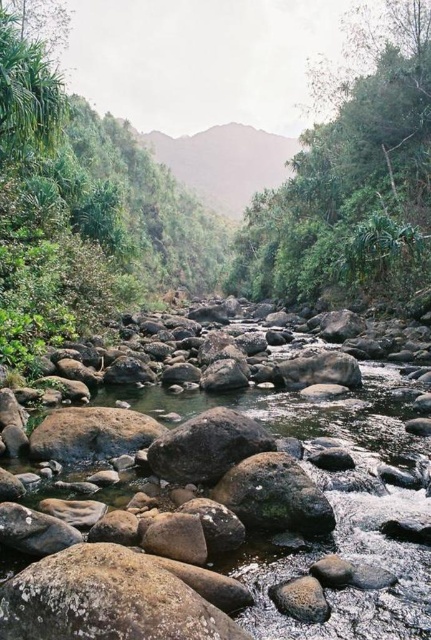
Question: Can you confirm if green leafy tree at upper right is bigger than green leafy tree at upper left?

Choices:
 (A) yes
 (B) no

Answer: (A)

Question: Is green leafy tree at upper right smaller than green leafy tree at upper left?

Choices:
 (A) yes
 (B) no

Answer: (B)

Question: From the image, what is the correct spatial relationship of green leafy tree at upper right in relation to green leafy tree at upper left?

Choices:
 (A) below
 (B) above

Answer: (B)